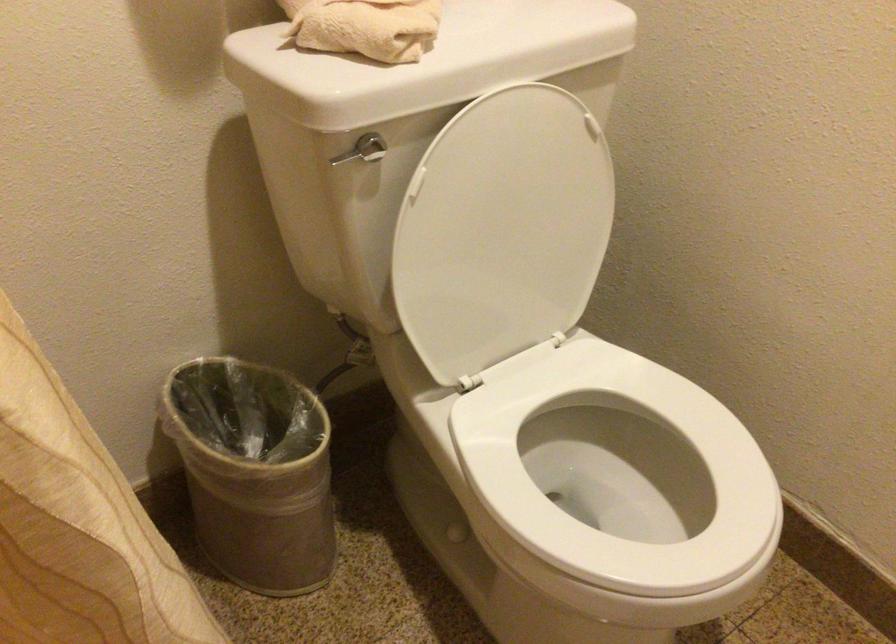
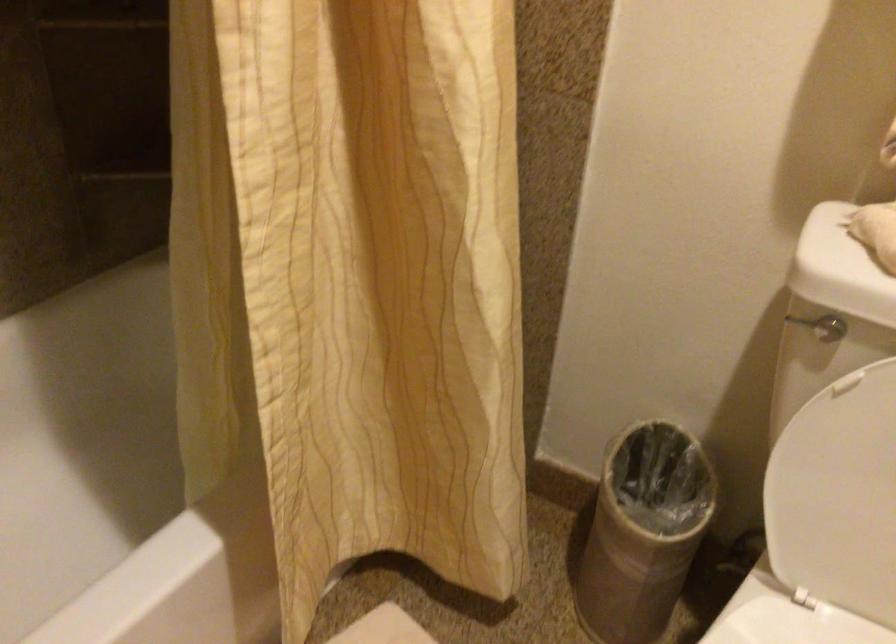
Locate, in the second image, the point that corresponds to pixel 306 462 in the first image.

(643, 532)